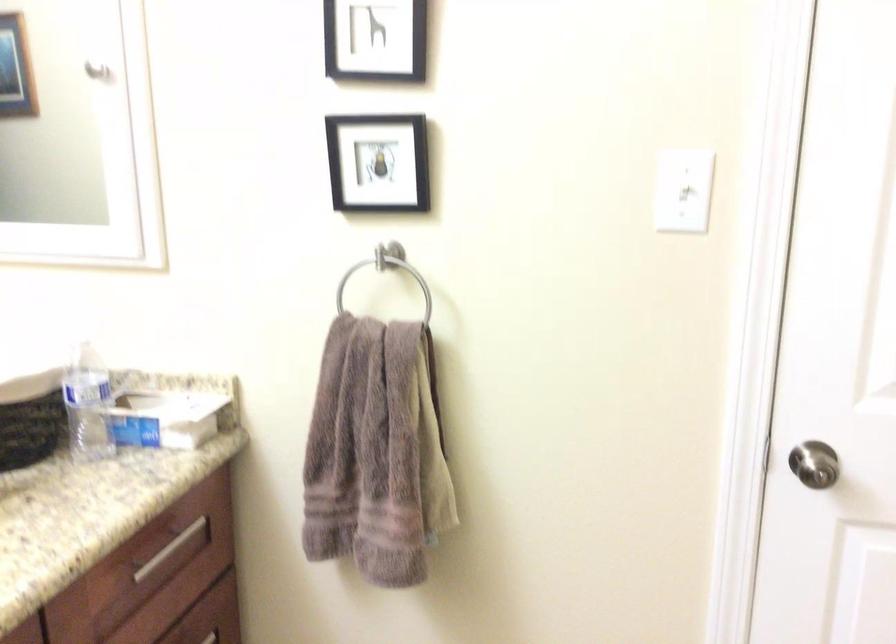
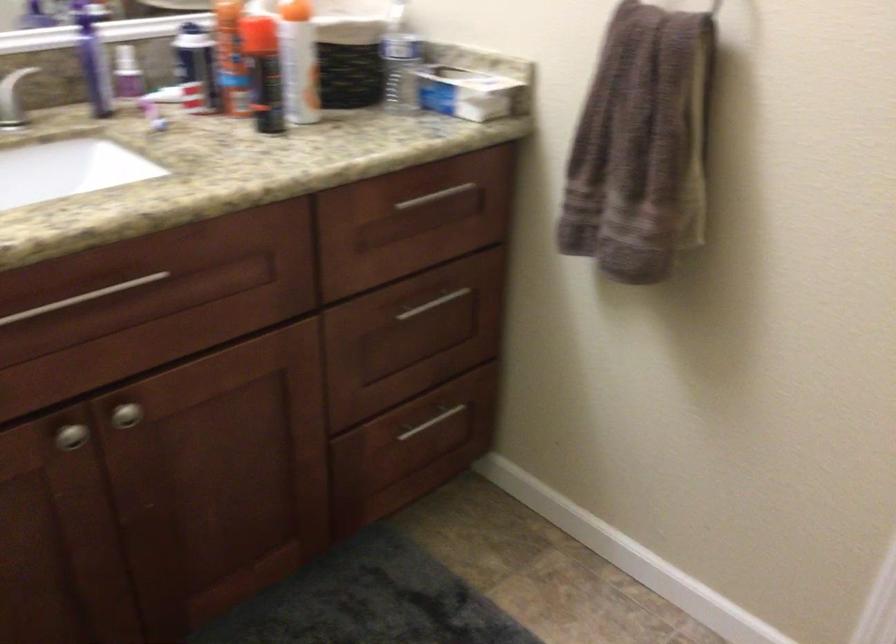
Where in the second image is the point corresponding to (392,448) from the first image?

(641, 146)